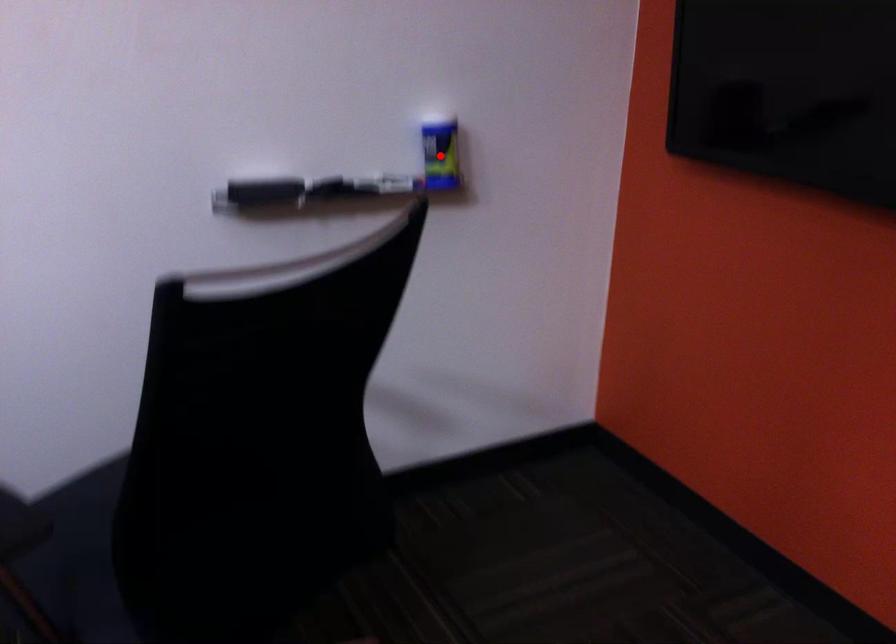
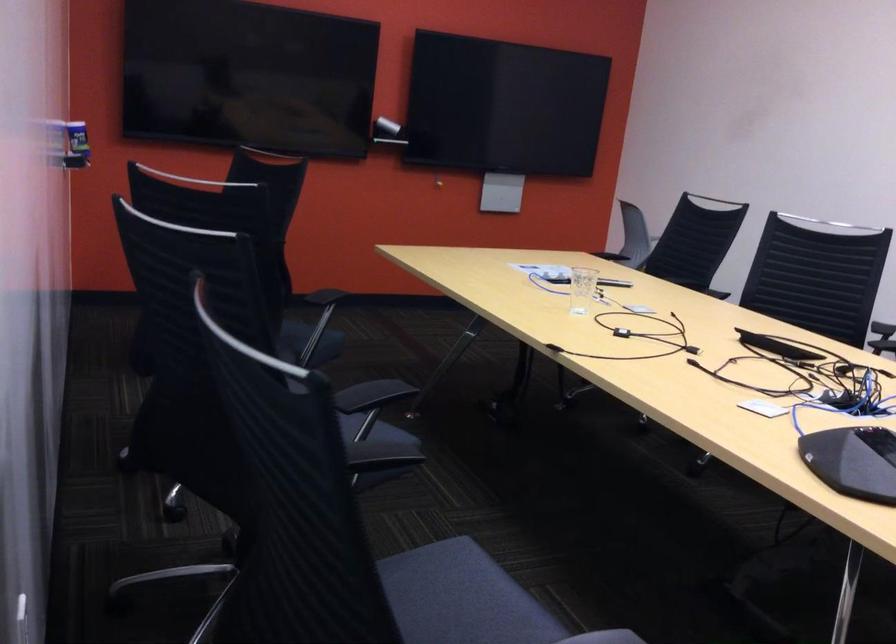
Question: I am providing you with two images of the same scene from different viewpoints. A red point is marked on the first image. Can you still see the location of the red point in image 2?

Choices:
 (A) Yes
 (B) No

Answer: (B)